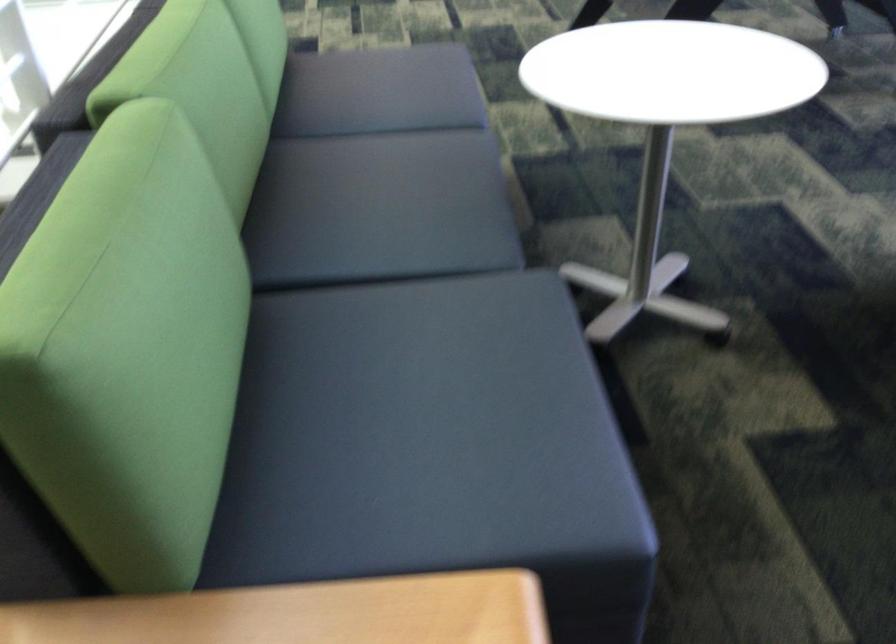
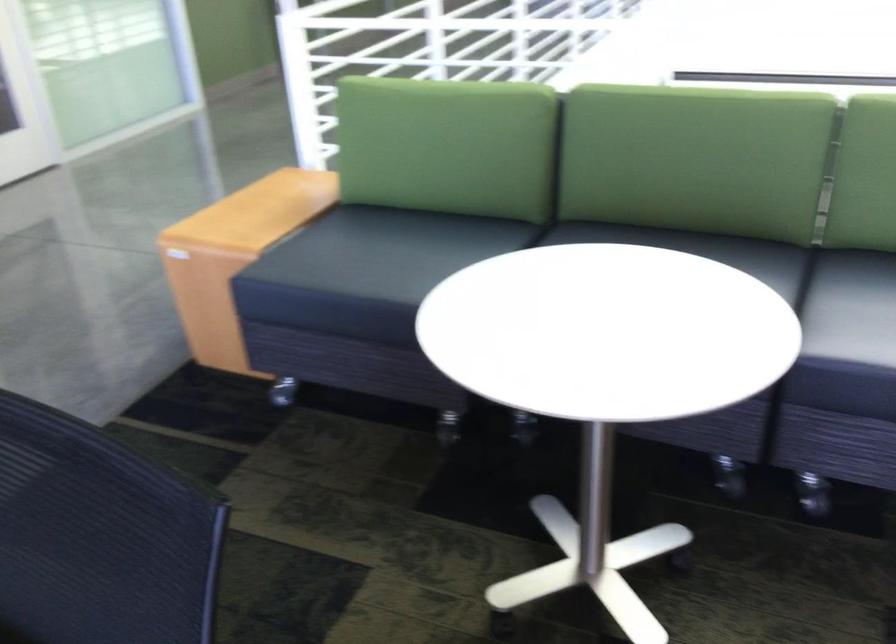
Question: I am providing you with two images of the same scene from different viewpoints. Which of the following objects are not visible in image2?

Choices:
 (A) blue storage box handle
 (B) black sofa sitting surface
 (C) dark sofa sitting surface
 (D) wooden sofa armrest

Answer: (C)